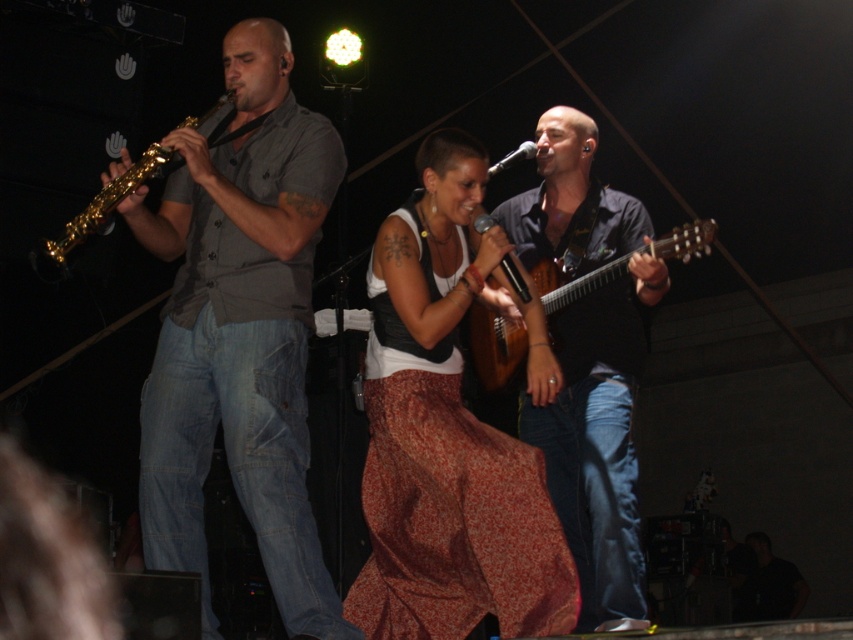
Does matte gray shirt at center appear on the left side of dark blue shirt at center?

Indeed, matte gray shirt at center is positioned on the left side of dark blue shirt at center.

Does point (234, 124) come farther from viewer compared to point (555, 449)?

No, (234, 124) is closer to viewer.

The width and height of the screenshot is (853, 640). I want to click on matte gray shirt at center, so click(241, 330).

Is point (498, 531) positioned before point (544, 296)?

Yes, it is in front of point (544, 296).

Where is `printed cotton skirt at center`? The height and width of the screenshot is (640, 853). printed cotton skirt at center is located at coordinates (445, 436).

Does printed cotton skirt at center come behind gold shiny saxophone at left?

Yes.

Based on the photo, is printed cotton skirt at center shorter than gold shiny saxophone at left?

No, printed cotton skirt at center is not shorter than gold shiny saxophone at left.

Identify the location of printed cotton skirt at center. (445, 436).